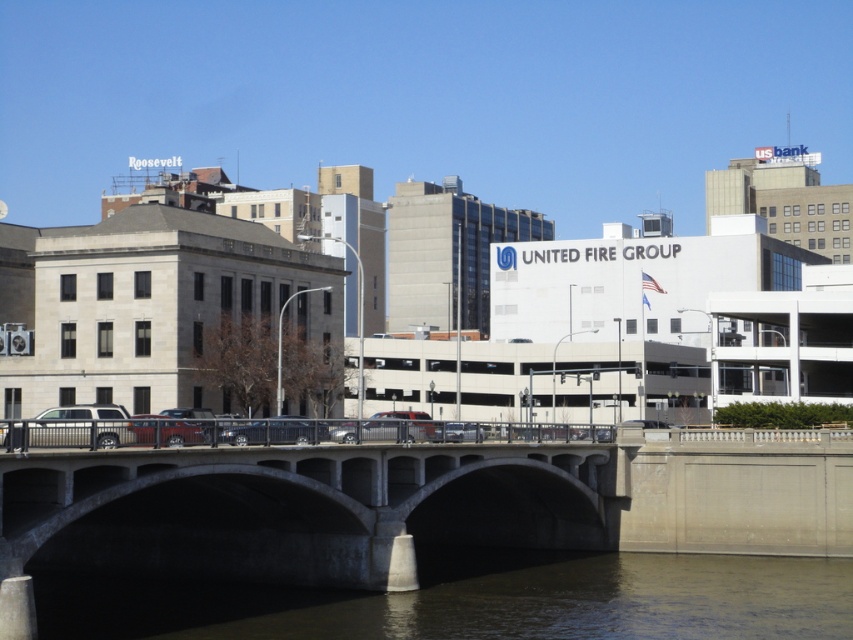
You are a pedestrian standing on the sidewalk near the concrete bridge at center and the brown concrete river at lower center. Which object is positioned to the left when facing the scene?

The concrete bridge at center is to the left of the brown concrete river at lower center.

You are a photographer trying to capture a shot of the silver metallic suv at center and the brown concrete river at lower center. Which object should you focus on first if you want to include both in your frame without moving the camera?

You should focus on the brown concrete river at lower center first because it is larger than the silver metallic suv at center, allowing it to occupy more space in the frame while still including the suv.

You are a photographer wanting to capture a shot of the silver metallic suv at center and the brown concrete river at lower center. Which object should you focus on first if you want to include both in your frame without moving the camera?

You should focus on the silver metallic suv at center first because the brown concrete river at lower center is positioned on its right side, meaning the suv is closer to the camera and the river is further away.